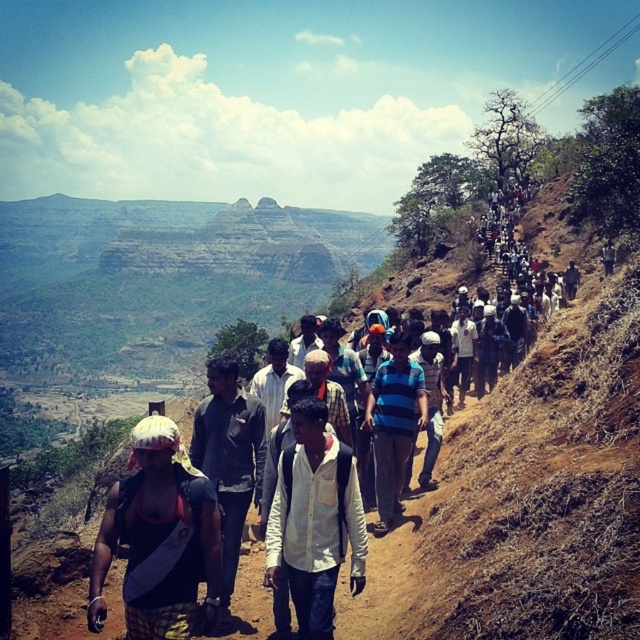
You are standing on the path and want to reach the top of the hill. Which point, point (92, 620) or point (372, 404), is closer to you and would be a better starting point for your ascent?

Point (92, 620) is closer to the viewer than point (372, 404), so it would be the better starting point for your ascent.